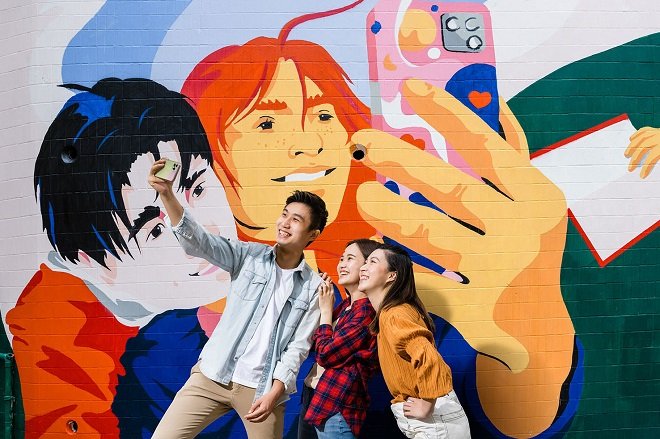
This screenshot has height=439, width=660. In order to click on 1 wall painting in this screenshot , I will do `click(561, 31)`.